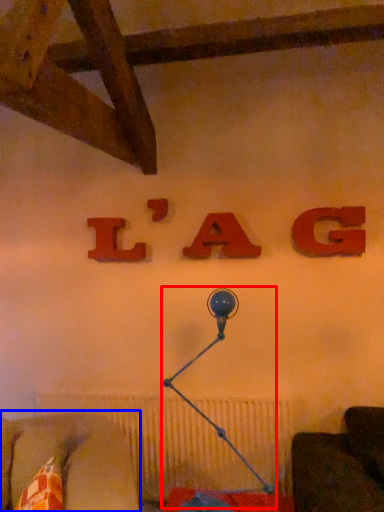
Question: Which of the following is the farthest to the observer, table lamp (highlighted by a red box) or furniture (highlighted by a blue box)?

Choices:
 (A) table lamp
 (B) furniture

Answer: (A)